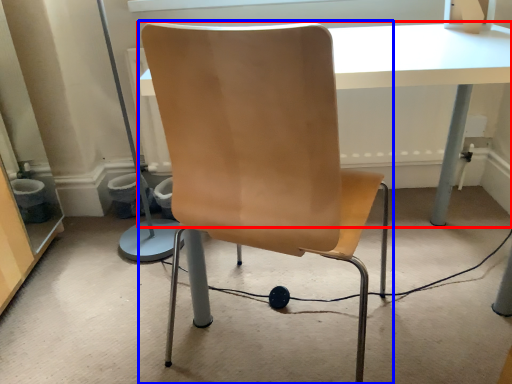
Question: Which of the following is the closest to the observer, table (highlighted by a red box) or chair (highlighted by a blue box)?

Choices:
 (A) table
 (B) chair

Answer: (B)